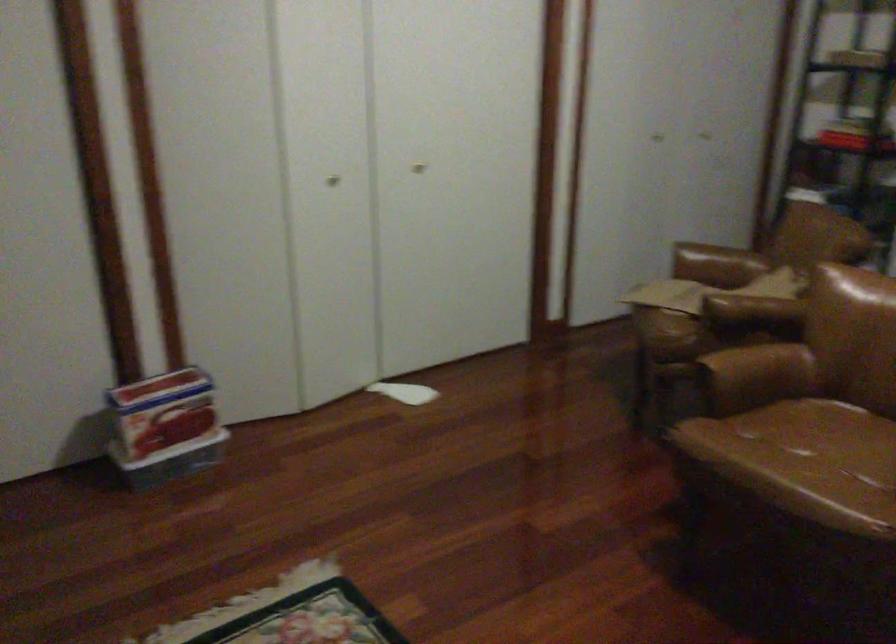
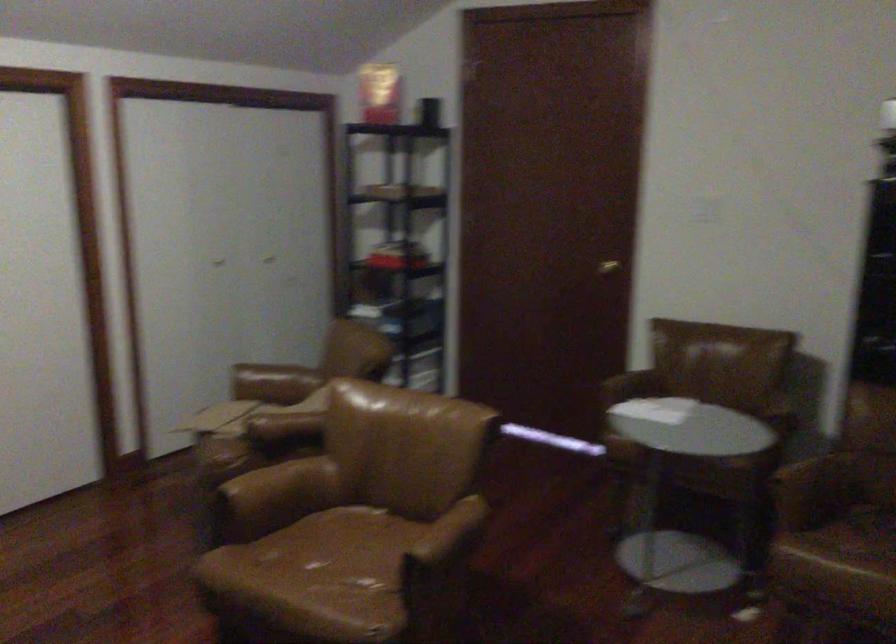
In the second image, find the point that corresponds to (x=819, y=442) in the first image.

(343, 556)